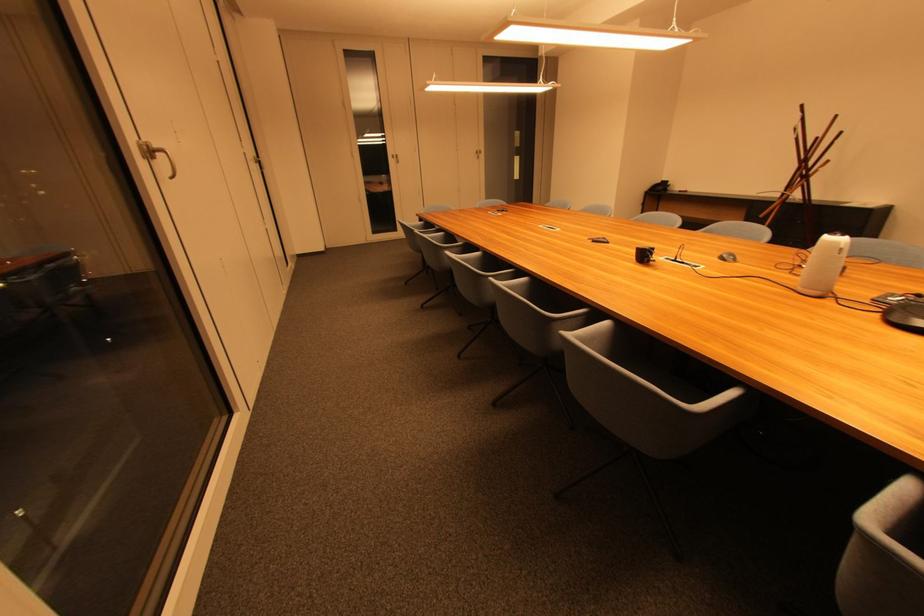
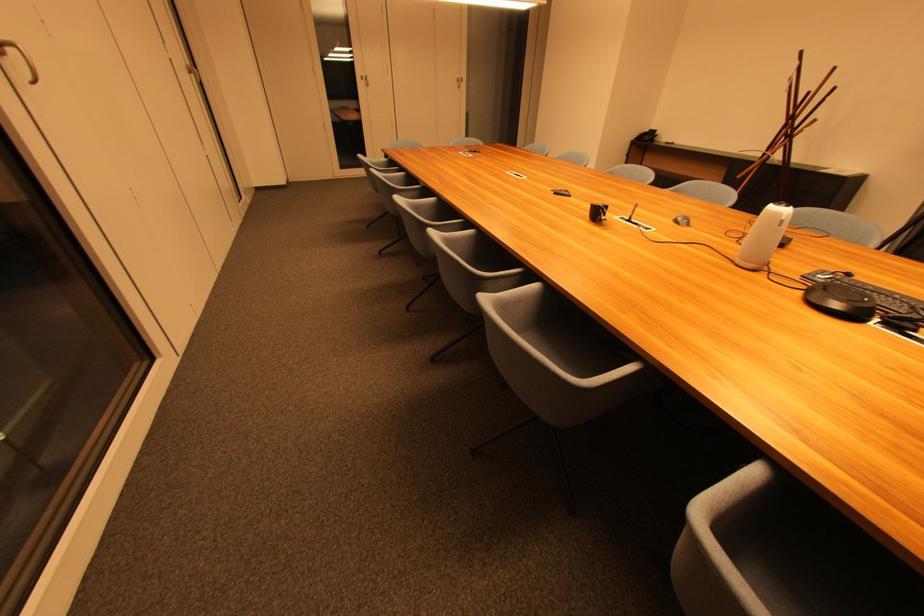
Question: The images are taken continuously from a first-person perspective. In which direction is your viewpoint rotating?

Choices:
 (A) Left
 (B) Right
 (C) Up
 (D) Down

Answer: (D)